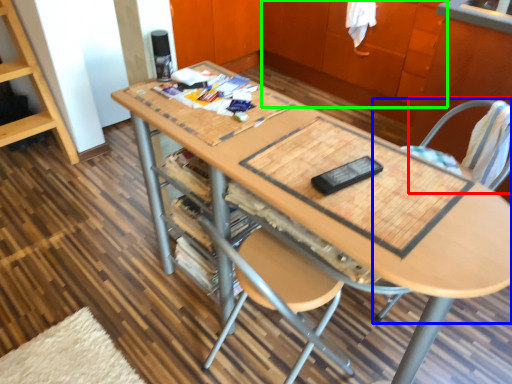
Question: Which object is the closest to the swivel chair (highlighted by a red box)? Choose among these: chair (highlighted by a blue box) or cabinetry (highlighted by a green box).

Choices:
 (A) chair
 (B) cabinetry

Answer: (A)